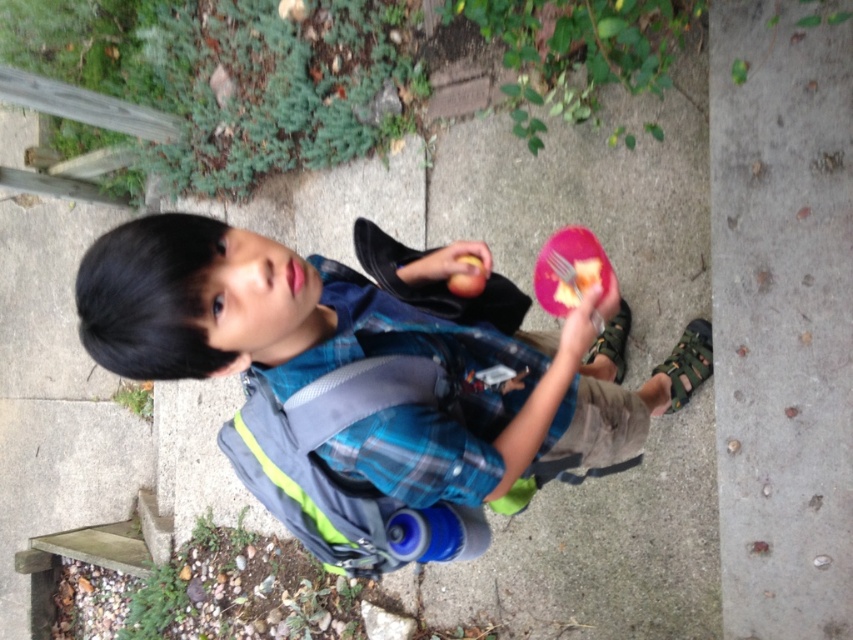
You are a photographer trying to capture the boy and his belongings in the image. Since you want to ensure both the gray concrete at lower right and the pink plastic fork at upper center are clearly visible in your shot, which object should you focus on to ensure proper framing?

The gray concrete at lower right is bigger than the pink plastic fork at upper center, so focusing on the gray concrete at lower right would ensure proper framing as it takes up more space in the image.

You are a delivery robot with a height of 3 feet. You need to deliver a package to the gray concrete at lower right while avoiding the pink plastic fork at upper center. Can you safely navigate between them without hitting the fork?

The gray concrete at lower right and pink plastic fork at upper center are 16.48 inches apart. Since the robot is 3 feet tall, which is 36 inches, and the distance between them is only 16.48 inches, the robot cannot safely navigate between them without hitting the fork.

You are a photographer standing 2 meters away from the boy. You want to take a photo of the point at coordinate point (402,532). Is the point within your camera range if your camera can focus up to 1.5 meters?

The distance of point (402,532) from the camera is 1.35 meters, which is within the camera focus range of 1.5 meters. Therefore, the point is within range and can be captured clearly.